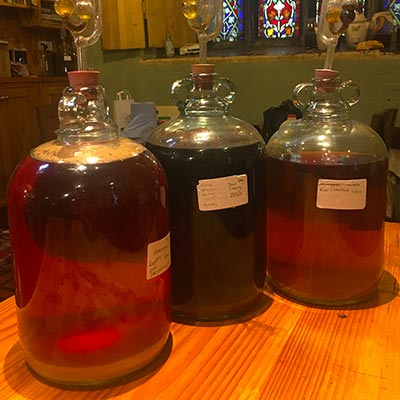
The height and width of the screenshot is (400, 400). I want to click on corks, so click(84, 75), click(200, 72), click(320, 74).